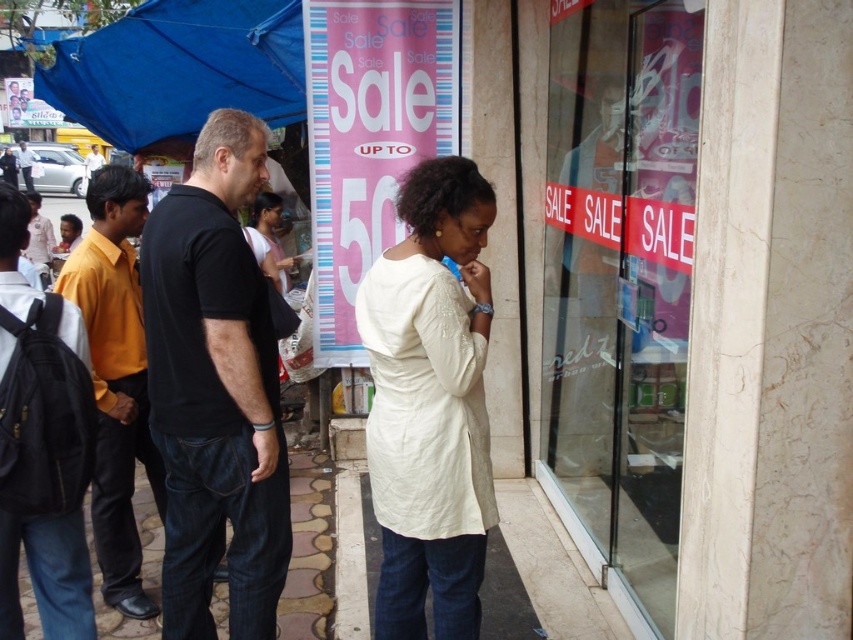
You are standing in front of the store and want to know which of the two points, point [161,506] or point [293,262], is closer to you. Can you determine this based on the scene?

Point [161,506] is closer to the viewer than point [293,262].

You are a delivery person who needs to place a package between the yellow shirt at left and the pink fabric shirt at center. The package is 3 feet long. Can you fit it between them?

The yellow shirt at left and pink fabric shirt at center are 8.60 feet apart from each other. Since the package is 3 feet long, it can easily fit between them as the distance is more than sufficient.

You are a customer standing in front of the store and you want to buy the white quilted dress at center and the black backpack at left. Which item is taller?

The white quilted dress at center is taller than the black backpack at left.